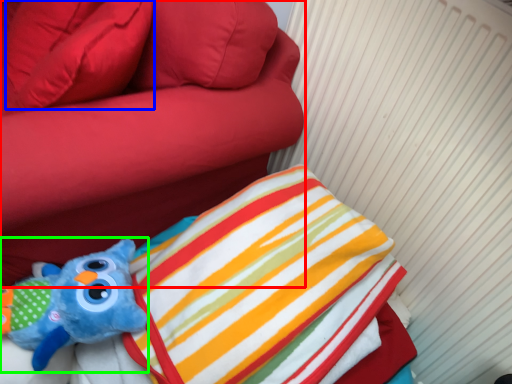
Question: Which is farther away from furniture (highlighted by a red box)? pillow (highlighted by a blue box) or toy (highlighted by a green box)?

Choices:
 (A) pillow
 (B) toy

Answer: (B)